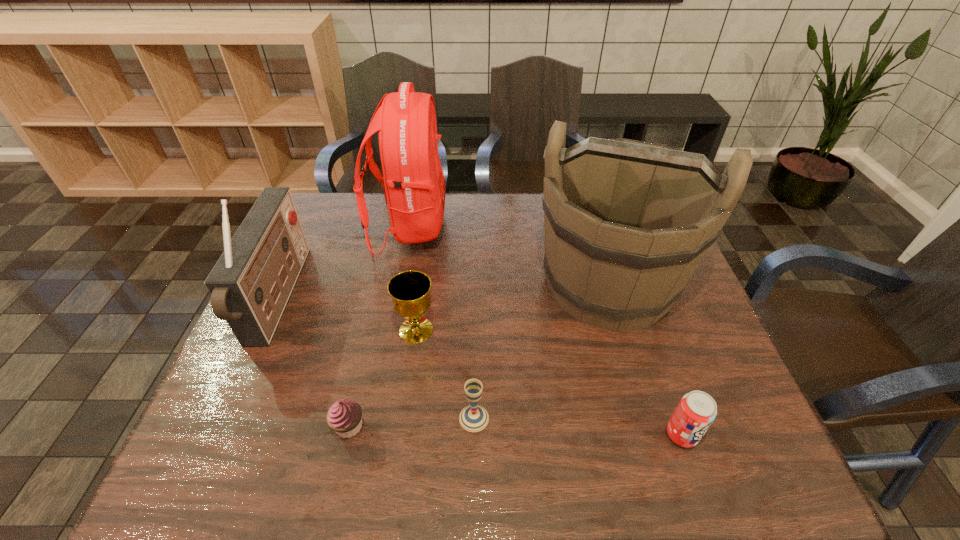
I want to click on vacant region located on the main compartment of the backpack, so click(x=562, y=227).

Where is `vacant space located on the back of the bucket`? This screenshot has height=540, width=960. vacant space located on the back of the bucket is located at coordinates (583, 200).

This screenshot has width=960, height=540. Identify the location of vacant space located on the front panel of the third tallest object. (388, 298).

You are a GUI agent. You are given a task and a screenshot of the screen. Output one action in this format:
    pyautogui.click(x=<x>, y=<y>)
    Task: Click on the blank space located on the back of the left chalice
    This screenshot has width=960, height=540.
    Given the screenshot: What is the action you would take?
    pyautogui.click(x=428, y=244)

Locate an element on the screen. The width and height of the screenshot is (960, 540). vacant space located 0.290m on the left of the soda can is located at coordinates (525, 435).

Locate an element on the screen. free point located on the left of the fifth object from left to right is located at coordinates (294, 418).

Where is `vacant space located 0.060m on the back of the cupcake`? The height and width of the screenshot is (540, 960). vacant space located 0.060m on the back of the cupcake is located at coordinates (358, 387).

You are a GUI agent. You are given a task and a screenshot of the screen. Output one action in this format:
    pyautogui.click(x=<x>, y=<y>)
    Task: Click on the backpack present at the far edge
    The image size is (960, 540).
    Given the screenshot: What is the action you would take?
    pyautogui.click(x=414, y=182)

Locate an element on the screen. This screenshot has width=960, height=540. bucket located in the far edge section of the desktop is located at coordinates (626, 223).

The image size is (960, 540). What are the coordinates of `soda can at the near edge` in the screenshot? It's located at (697, 410).